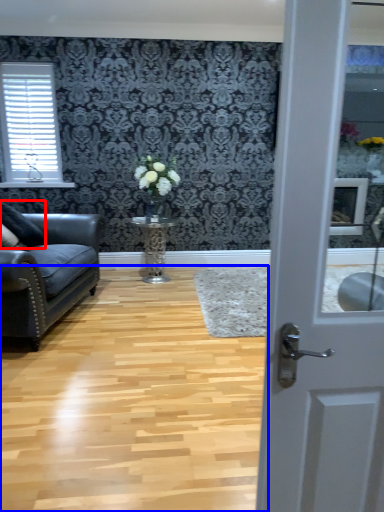
Question: Which of the following is the farthest to the observer, pillow (highlighted by a red box) or plain (highlighted by a blue box)?

Choices:
 (A) pillow
 (B) plain

Answer: (A)